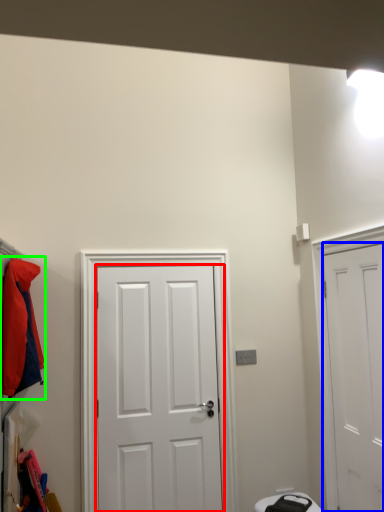
Question: Based on their relative distances, which object is farther from door (highlighted by a red box)? Choose from door (highlighted by a blue box) and jacket (highlighted by a green box).

Choices:
 (A) door
 (B) jacket

Answer: (A)